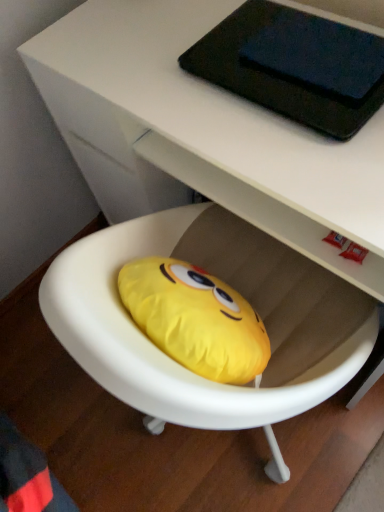
The width and height of the screenshot is (384, 512). I want to click on free space that is to the left of black matte tablet at upper center, so click(167, 90).